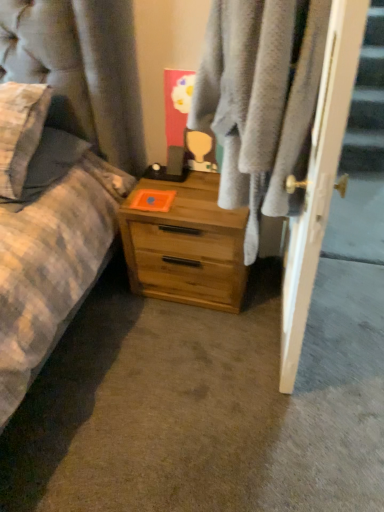
Question: From a real-world perspective, is white glossy door at right positioned above or below light wood chest of drawers at center?

Choices:
 (A) below
 (B) above

Answer: (B)

Question: Considering their positions, is white glossy door at right located in front of or behind light wood chest of drawers at center?

Choices:
 (A) behind
 (B) front

Answer: (B)

Question: Considering the real-world distances, which object is farthest from the white glossy door at right?

Choices:
 (A) light wood chest of drawers at center
 (B) soft gray towel at center

Answer: (A)

Question: Estimate the real-world distances between objects in this image. Which object is farther from the white glossy door at right?

Choices:
 (A) soft gray towel at center
 (B) light wood chest of drawers at center

Answer: (B)